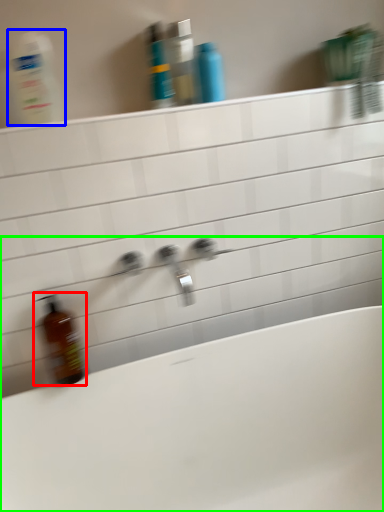
Question: Estimate the real-world distances between objects in this image. Which object is closer to bottle (highlighted by a red box), cleaning product (highlighted by a blue box) or bathtub (highlighted by a green box)?

Choices:
 (A) cleaning product
 (B) bathtub

Answer: (B)